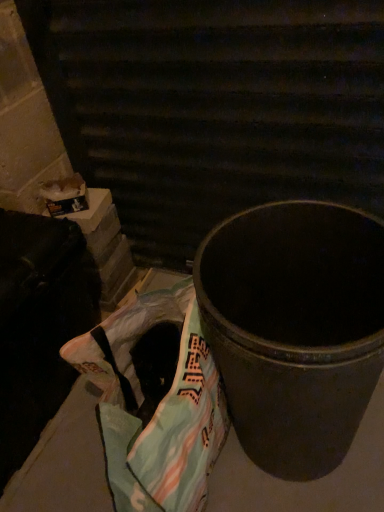
Question: From the image's perspective, is plastic grocery bag at lower left over metallic trash can at center?

Choices:
 (A) no
 (B) yes

Answer: (A)

Question: Is plastic grocery bag at lower left positioned in front of metallic trash can at center?

Choices:
 (A) yes
 (B) no

Answer: (B)

Question: Is plastic grocery bag at lower left located outside metallic trash can at center?

Choices:
 (A) no
 (B) yes

Answer: (B)

Question: Is plastic grocery bag at lower left turned away from metallic trash can at center?

Choices:
 (A) no
 (B) yes

Answer: (A)

Question: Can you confirm if plastic grocery bag at lower left is wider than metallic trash can at center?

Choices:
 (A) yes
 (B) no

Answer: (B)

Question: From their relative heights in the image, would you say metallic black trash can at center is taller or shorter than metallic trash can at center?

Choices:
 (A) short
 (B) tall

Answer: (B)

Question: In the image, is metallic black trash can at center positioned in front of or behind metallic trash can at center?

Choices:
 (A) behind
 (B) front

Answer: (A)

Question: Is point (64, 13) positioned closer to the camera than point (299, 436)?

Choices:
 (A) closer
 (B) farther

Answer: (B)

Question: Based on their sizes in the image, would you say metallic black trash can at center is bigger or smaller than metallic trash can at center?

Choices:
 (A) big
 (B) small

Answer: (B)

Question: Considering the positions of point (311, 343) and point (56, 45), is point (311, 343) closer or farther from the camera than point (56, 45)?

Choices:
 (A) closer
 (B) farther

Answer: (A)

Question: Is metallic trash can at center bigger or smaller than metallic black trash can at center?

Choices:
 (A) small
 (B) big

Answer: (B)

Question: Considering the relative positions of metallic trash can at center and metallic black trash can at center in the image provided, is metallic trash can at center to the left or to the right of metallic black trash can at center?

Choices:
 (A) left
 (B) right

Answer: (B)

Question: Is metallic trash can at center taller or shorter than metallic black trash can at center?

Choices:
 (A) tall
 (B) short

Answer: (B)

Question: Is point (152, 486) closer or farther from the camera than point (175, 181)?

Choices:
 (A) closer
 (B) farther

Answer: (A)

Question: Choose the correct answer: Is plastic grocery bag at lower left inside metallic black trash can at center or outside it?

Choices:
 (A) inside
 (B) outside

Answer: (B)